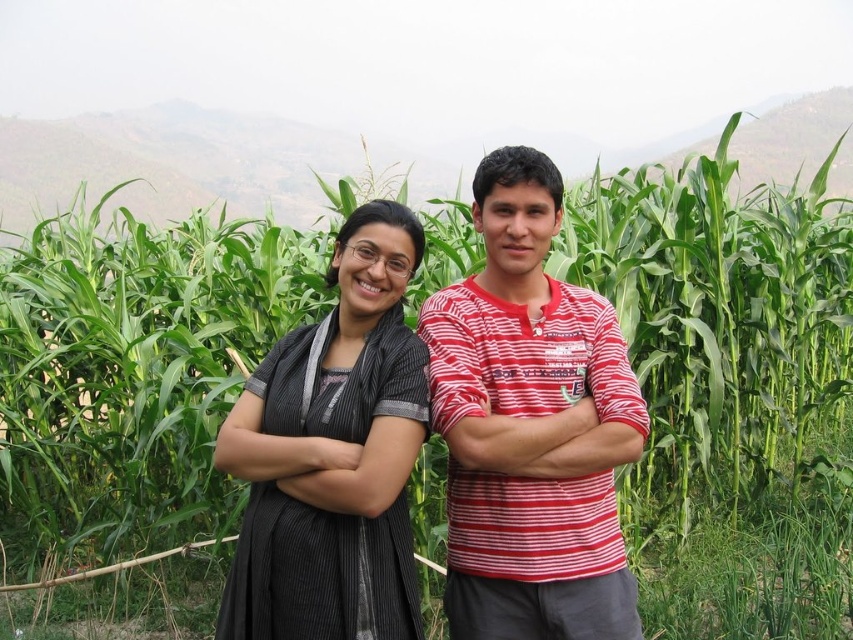
Can you confirm if striped cotton shirt at center is smaller than matte black dress at center?

Incorrect, striped cotton shirt at center is not smaller in size than matte black dress at center.

This screenshot has height=640, width=853. What do you see at coordinates (531, 426) in the screenshot?
I see `striped cotton shirt at center` at bounding box center [531, 426].

Find the location of a particular element. This screenshot has width=853, height=640. striped cotton shirt at center is located at coordinates (531, 426).